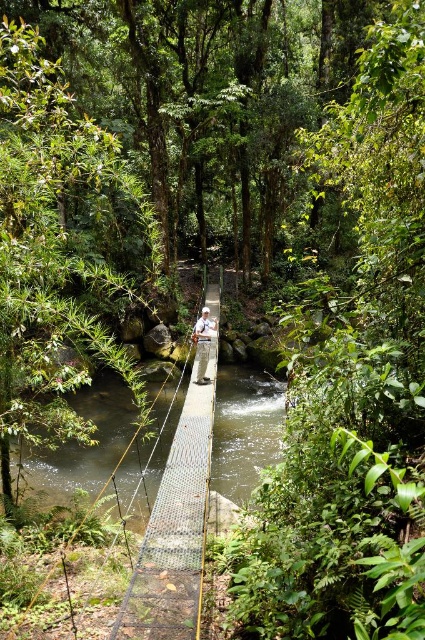
Does clear water at bridge center have a lesser width compared to white fabric shirt at center?

No, clear water at bridge center is not thinner than white fabric shirt at center.

Locate an element on the screen. This screenshot has width=425, height=640. clear water at bridge center is located at coordinates (244, 429).

Does point (135, 518) come behind point (206, 355)?

No, it is not.

I want to click on clear water at bridge center, so click(244, 429).